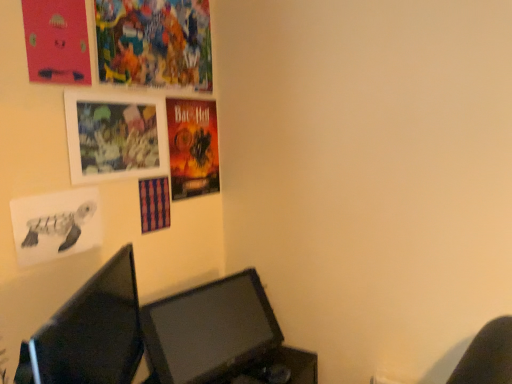
Question: From a real-world perspective, is vibrant paper poster at upper left, the first poster page in the top-to-bottom sequence, under matte pink poster at upper left, which ranks as the 2th poster page in top-to-bottom order?

Choices:
 (A) no
 (B) yes

Answer: (A)

Question: Can you see vibrant paper poster at upper left, which is the third poster page from bottom to top, touching matte pink poster at upper left, the 2th poster page positioned from the bottom?

Choices:
 (A) no
 (B) yes

Answer: (A)

Question: Does vibrant paper poster at upper left, which is the third poster page from bottom to top, appear on the right side of matte pink poster at upper left, the 2th poster page positioned from the bottom?

Choices:
 (A) no
 (B) yes

Answer: (B)

Question: Is the position of vibrant paper poster at upper left, which is the third poster page from bottom to top, less distant than that of matte pink poster at upper left, which ranks as the 2th poster page in top-to-bottom order?

Choices:
 (A) no
 (B) yes

Answer: (A)

Question: Is vibrant paper poster at upper left, the first poster page in the top-to-bottom sequence, wider than matte pink poster at upper left, which ranks as the 2th poster page in top-to-bottom order?

Choices:
 (A) yes
 (B) no

Answer: (A)

Question: From a real-world perspective, is vibrant paper poster at upper left, which is the third poster page from bottom to top, positioned above or below matte black monitor at lower center, the first computer monitor in the back-to-front sequence?

Choices:
 (A) below
 (B) above

Answer: (B)

Question: Considering the positions of vibrant paper poster at upper left, which is the third poster page from bottom to top, and matte black monitor at lower center, marked as the 2th computer monitor in a front-to-back arrangement, in the image, is vibrant paper poster at upper left, which is the third poster page from bottom to top, wider or thinner than matte black monitor at lower center, marked as the 2th computer monitor in a front-to-back arrangement,?

Choices:
 (A) wide
 (B) thin

Answer: (B)

Question: Based on their sizes in the image, would you say vibrant paper poster at upper left, which is the third poster page from bottom to top, is bigger or smaller than matte black monitor at lower center, marked as the 2th computer monitor in a front-to-back arrangement?

Choices:
 (A) big
 (B) small

Answer: (B)

Question: Visually, is vibrant paper poster at upper left, which is the third poster page from bottom to top, positioned to the left or to the right of matte black monitor at lower center, marked as the 2th computer monitor in a front-to-back arrangement?

Choices:
 (A) right
 (B) left

Answer: (B)

Question: From a real-world perspective, is matte black monitor at lower left, which is the second computer monitor from back to front, physically located above or below shiny paper poster at upper center?

Choices:
 (A) below
 (B) above

Answer: (A)

Question: Is point (121, 311) positioned closer to the camera than point (206, 125)?

Choices:
 (A) farther
 (B) closer

Answer: (B)

Question: Is matte black monitor at lower left, which is the 1th computer monitor in front-to-back order, taller or shorter than shiny paper poster at upper center?

Choices:
 (A) short
 (B) tall

Answer: (B)

Question: From the image's perspective, relative to shiny paper poster at upper center, is matte black monitor at lower left, which is the second computer monitor from back to front, above or below?

Choices:
 (A) below
 (B) above

Answer: (A)

Question: Considering the positions of vibrant paper poster at upper left, which is the third poster page from bottom to top, and shiny paper poster at upper center in the image, is vibrant paper poster at upper left, which is the third poster page from bottom to top, bigger or smaller than shiny paper poster at upper center?

Choices:
 (A) small
 (B) big

Answer: (B)

Question: Choose the correct answer: Is vibrant paper poster at upper left, which is the third poster page from bottom to top, inside shiny paper poster at upper center or outside it?

Choices:
 (A) outside
 (B) inside

Answer: (A)